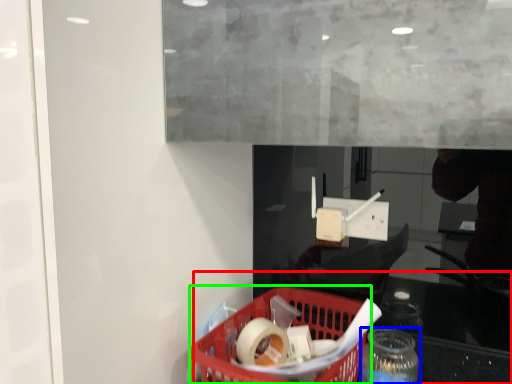
Question: Which is farther away from table (highlighted by a red box)? bottle (highlighted by a blue box) or basket (highlighted by a green box)?

Choices:
 (A) bottle
 (B) basket

Answer: (A)